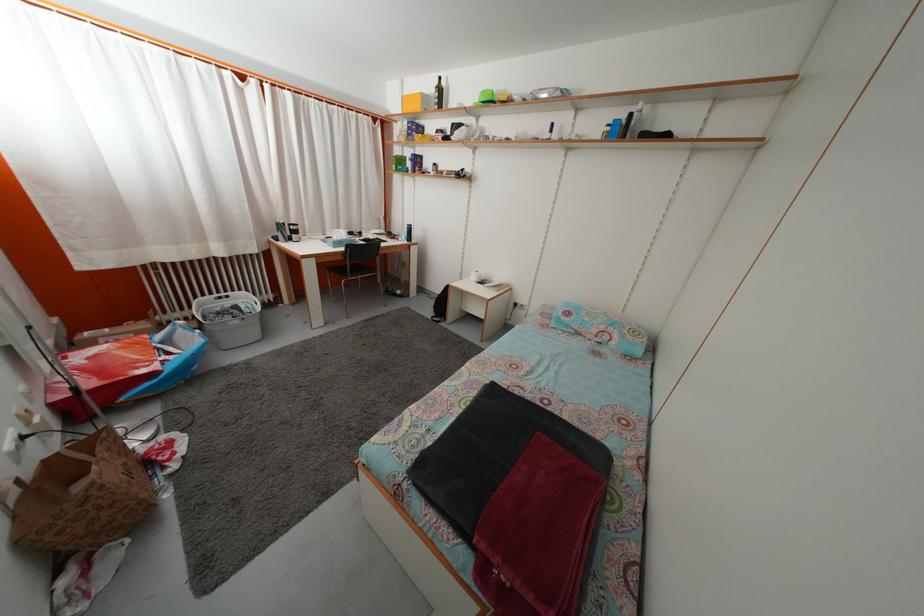
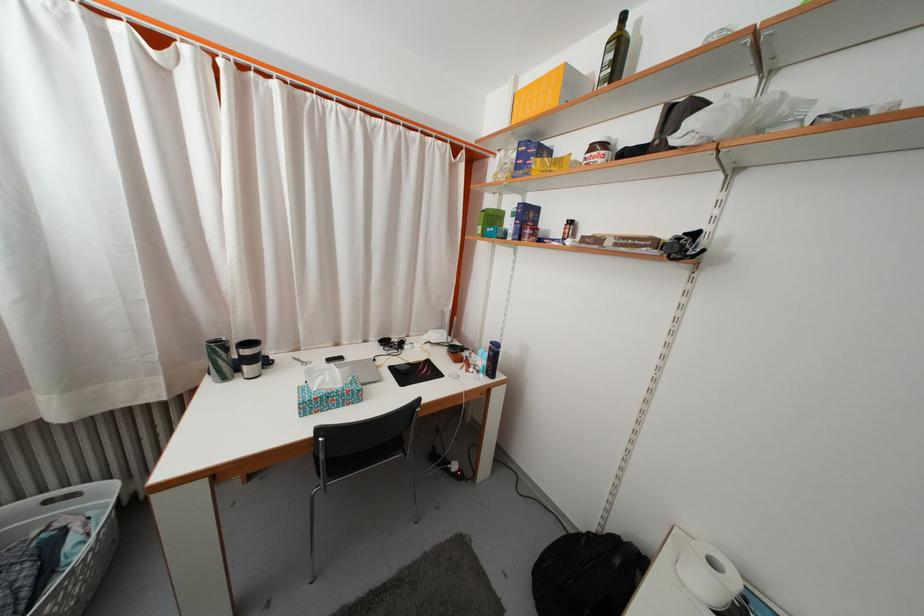
In the second image, find the point that corresponds to pixel 445 98 in the first image.

(625, 54)